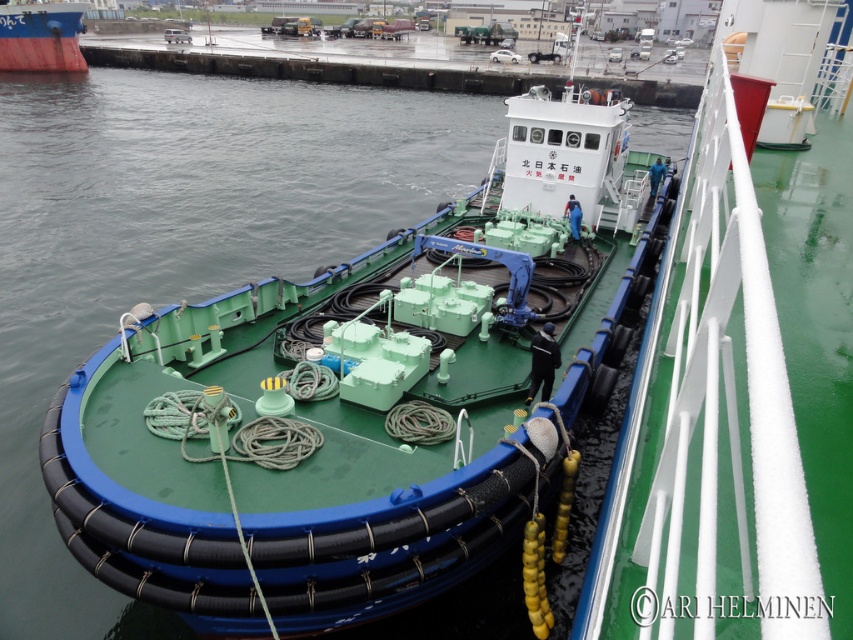
You are a dock worker who needs to load a new cargo container onto the green rubber boat at center and the red matte boat at upper left. Which boat will require a narrower loading ramp because of its size?

The green rubber boat at center is thinner than the red matte boat at upper left, so it will require a narrower loading ramp.